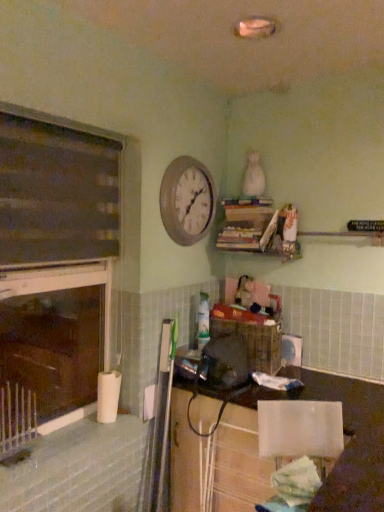
Find the location of a particular element. spots to the right of silver metallic radiator at lower left is located at coordinates (58, 449).